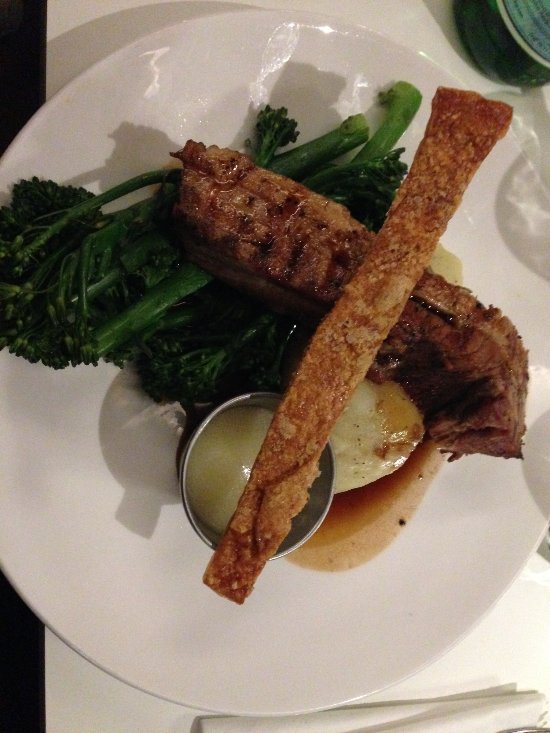
Where is `napkin`? This screenshot has width=550, height=733. napkin is located at coordinates (498, 707).